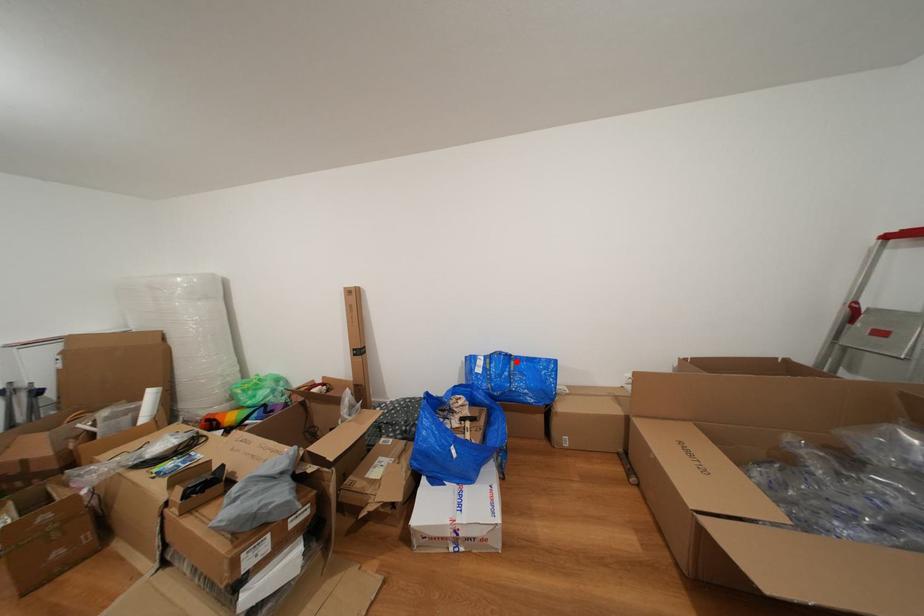
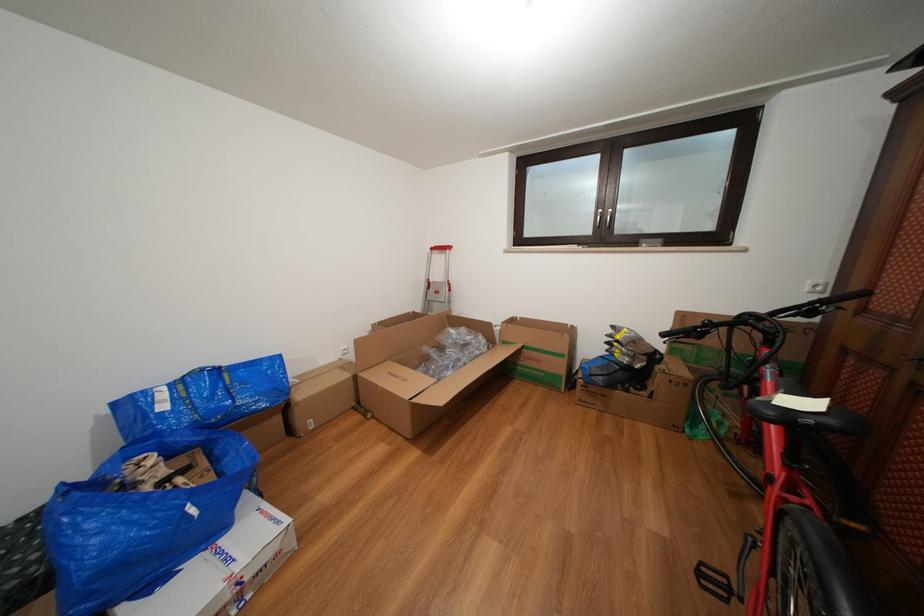
Where in the second image is the point corresponding to the highlighted location from the first image?

(225, 376)